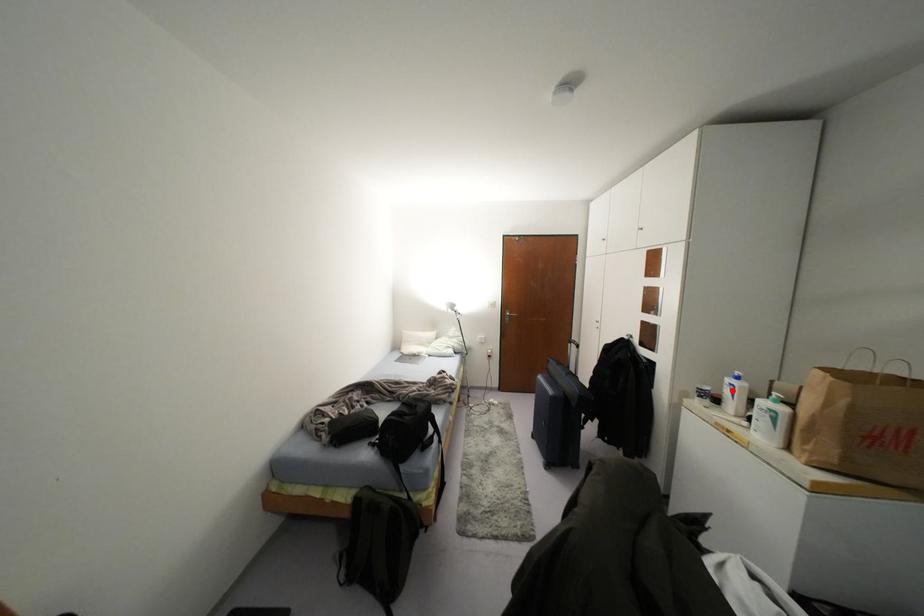
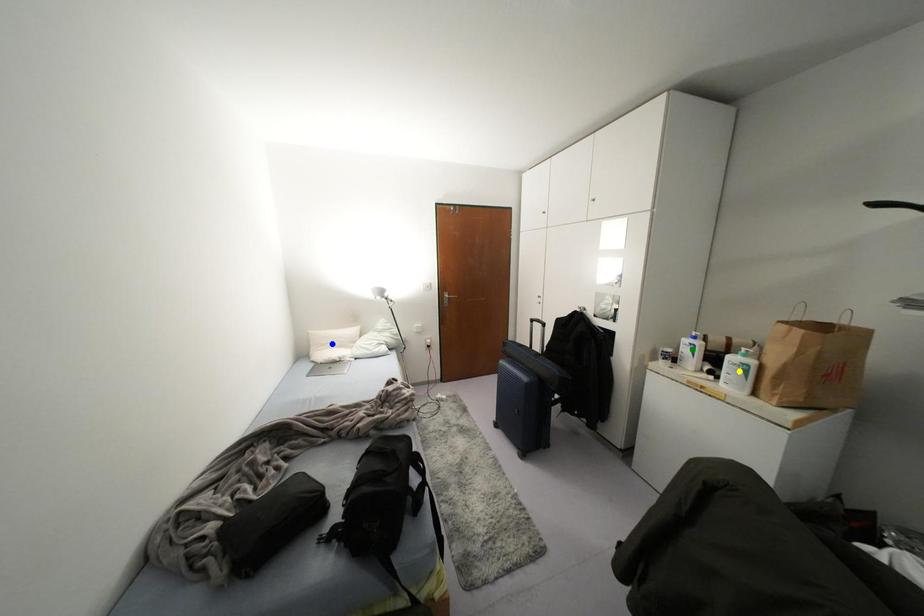
Question: I am providing you with two images of the same scene from different viewpoints. A red point is marked on the first image. You are given multiple points on the second image. Which point in image 2 represents the same 3d spot as the red point in image 1?

Choices:
 (A) blue point
 (B) yellow point
 (C) green point

Answer: (C)